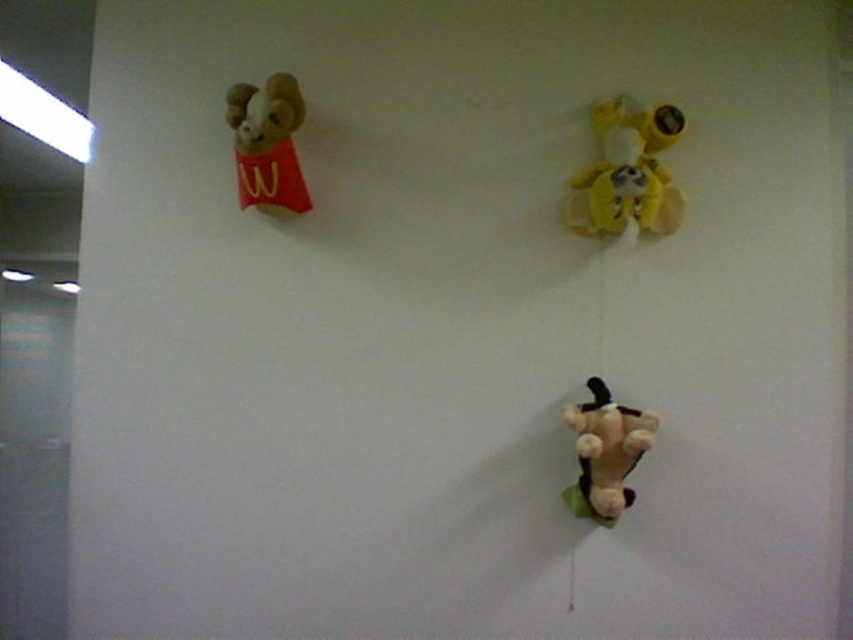
Question: Is yellow plush toy at upper right thinner than soft brown plush toy at bottom right?

Choices:
 (A) yes
 (B) no

Answer: (B)

Question: Which object is positioned closest to the yellow plush toy at upper right?

Choices:
 (A) velvet plush ram at upper left
 (B) soft brown plush toy at bottom right

Answer: (B)

Question: Which point appears closest to the camera in this image?

Choices:
 (A) (635, 128)
 (B) (259, 134)
 (C) (643, 417)

Answer: (C)

Question: Which of these objects is positioned farthest from the yellow plush toy at upper right?

Choices:
 (A) velvet plush ram at upper left
 (B) soft brown plush toy at bottom right

Answer: (A)

Question: Where is velvet plush ram at upper left located in relation to soft brown plush toy at bottom right in the image?

Choices:
 (A) right
 (B) left

Answer: (B)

Question: Can you confirm if yellow plush toy at upper right is smaller than velvet plush ram at upper left?

Choices:
 (A) no
 (B) yes

Answer: (A)